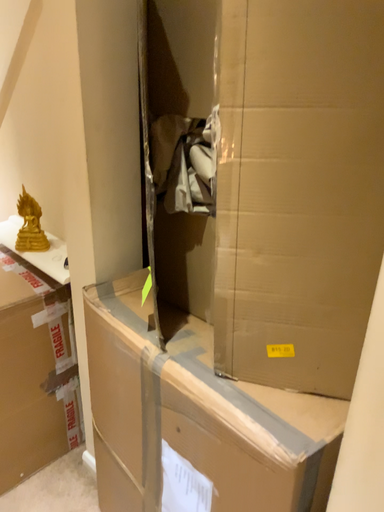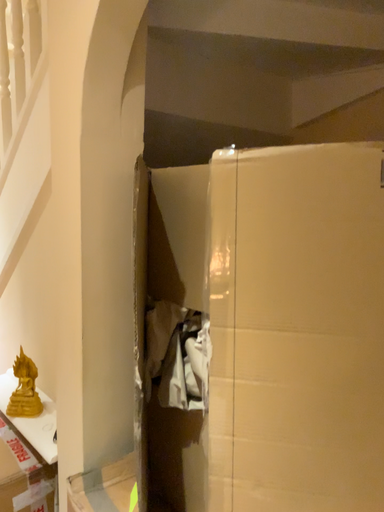
Question: Which way did the camera rotate in the video?

Choices:
 (A) rotated upward
 (B) rotated downward

Answer: (A)